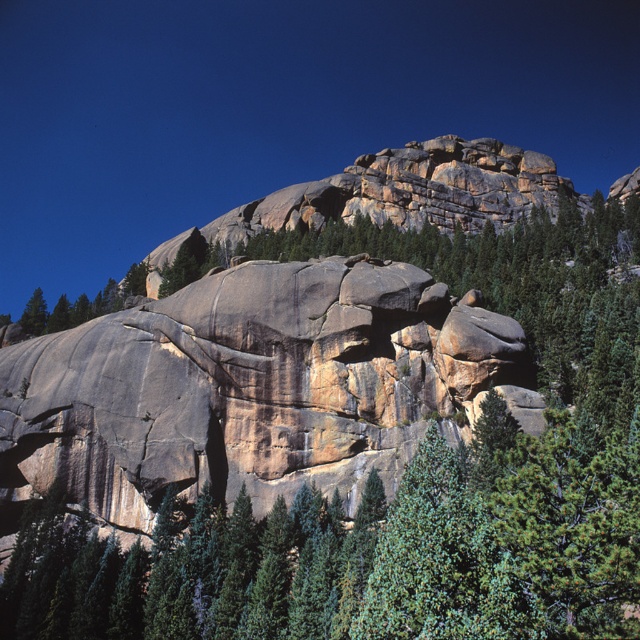
From the picture: Does rough granite rock at center lie in front of gray granite rock face at center?

No, it is not.

Does point (29, 272) lie behind point (227, 428)?

Yes.

Locate an element on the screen. The height and width of the screenshot is (640, 640). rough granite rock at center is located at coordinates (275, 109).

Where is `rough granite rock at center`? This screenshot has height=640, width=640. rough granite rock at center is located at coordinates (275, 109).